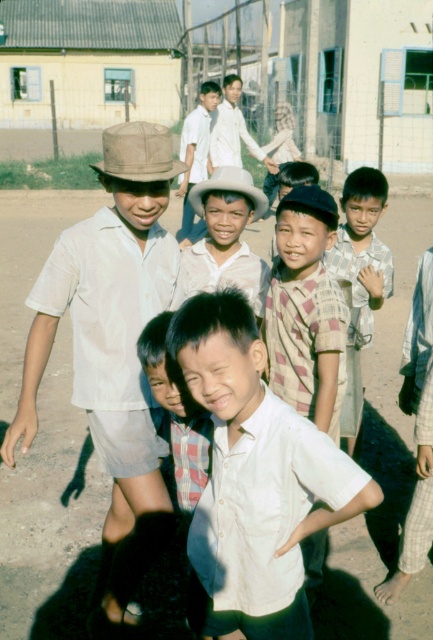
Is point (339, 516) closer to camera compared to point (204, 163)?

Yes, it is.

Is white cotton shirt at center positioned before light brown cotton shirt at center?

That is True.

Who is more distant from viewer, (230, 630) or (187, 208)?

The point (187, 208) is behind.

This screenshot has width=433, height=640. Identify the location of white cotton shirt at center. click(255, 476).

Who is shorter, matte brown hat at left or checkered fabric shirt at center?

With less height is checkered fabric shirt at center.

Can you confirm if matte brown hat at left is smaller than checkered fabric shirt at center?

Actually, matte brown hat at left might be larger than checkered fabric shirt at center.

The width and height of the screenshot is (433, 640). Identify the location of matte brown hat at left. (113, 342).

Can you confirm if white cotton shirt at center is positioned to the left of matte white shirt at center?

In fact, white cotton shirt at center is to the right of matte white shirt at center.

Can you confirm if white cotton shirt at center is thinner than matte white shirt at center?

Incorrect, white cotton shirt at center's width is not less than matte white shirt at center's.

Is point (251, 381) closer to camera compared to point (232, 232)?

Yes, point (251, 381) is in front of point (232, 232).

Identify the location of white cotton shirt at center. This screenshot has width=433, height=640. (255, 476).